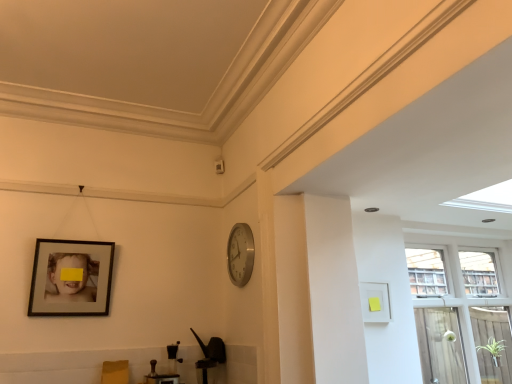
Question: Is silver metallic clock at center-right positioned before transparent glass window at right?

Choices:
 (A) yes
 (B) no

Answer: (A)

Question: Is silver metallic clock at center-right shorter than transparent glass window at right?

Choices:
 (A) no
 (B) yes

Answer: (B)

Question: Is silver metallic clock at center-right surrounding transparent glass window at right?

Choices:
 (A) no
 (B) yes

Answer: (A)

Question: From the image's perspective, is silver metallic clock at center-right under transparent glass window at right?

Choices:
 (A) no
 (B) yes

Answer: (A)

Question: Does silver metallic clock at center-right appear on the right side of transparent glass window at right?

Choices:
 (A) no
 (B) yes

Answer: (A)

Question: From a real-world perspective, is silver metallic clock at center-right physically located above or below white matte picture frame at right, the first picture frame viewed from the right?

Choices:
 (A) above
 (B) below

Answer: (A)

Question: From the image's perspective, relative to white matte picture frame at right, the first picture frame viewed from the right, is silver metallic clock at center-right above or below?

Choices:
 (A) above
 (B) below

Answer: (A)

Question: Considering the positions of point tap(245, 233) and point tap(360, 292), is point tap(245, 233) closer or farther from the camera than point tap(360, 292)?

Choices:
 (A) farther
 (B) closer

Answer: (A)

Question: Is silver metallic clock at center-right taller or shorter than white matte picture frame at right, which appears as the 2th picture frame when viewed from the left?

Choices:
 (A) tall
 (B) short

Answer: (A)

Question: Relative to clear glass screen door at right, is silver metallic clock at center-right in front or behind?

Choices:
 (A) front
 (B) behind

Answer: (A)

Question: From the image's perspective, is silver metallic clock at center-right positioned above or below clear glass screen door at right?

Choices:
 (A) below
 (B) above

Answer: (B)

Question: Considering the relative positions of silver metallic clock at center-right and clear glass screen door at right in the image provided, is silver metallic clock at center-right to the left or to the right of clear glass screen door at right?

Choices:
 (A) left
 (B) right

Answer: (A)

Question: Based on their sizes in the image, would you say silver metallic clock at center-right is bigger or smaller than clear glass screen door at right?

Choices:
 (A) big
 (B) small

Answer: (B)

Question: Looking at their shapes, would you say matte black picture frame at left, which is the second picture frame in right-to-left order, is wider or thinner than clear glass screen door at right?

Choices:
 (A) thin
 (B) wide

Answer: (A)

Question: Is matte black picture frame at left, which is the second picture frame in right-to-left order, in front of or behind clear glass screen door at right in the image?

Choices:
 (A) behind
 (B) front

Answer: (B)